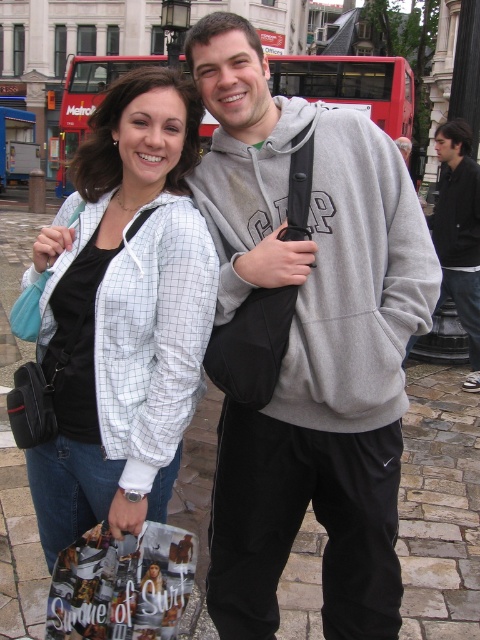
Which is in front, point (331, 307) or point (386, 128)?

Point (331, 307) is in front.

Is point (396, 516) less distant than point (312, 92)?

That is True.

You are a GUI agent. You are given a task and a screenshot of the screen. Output one action in this format:
    pyautogui.click(x=<x>, y=<y>)
    Task: Click on the gray cotton hoodie at center
    Image resolution: width=480 pixels, height=640 pixels.
    Given the screenshot: What is the action you would take?
    pyautogui.click(x=309, y=342)

The image size is (480, 640). I want to click on white checkered jacket at upper left, so click(x=123, y=316).

Who is positioned more to the right, white checkered jacket at upper left or red double-decker bus at upper center?

From the viewer's perspective, red double-decker bus at upper center appears more on the right side.

You are a GUI agent. You are given a task and a screenshot of the screen. Output one action in this format:
    pyautogui.click(x=<x>, y=<y>)
    Task: Click on the white checkered jacket at upper left
    
    Given the screenshot: What is the action you would take?
    pyautogui.click(x=123, y=316)

Does gray cotton hoodie at center appear over white checkered jacket at upper left?

No.

This screenshot has width=480, height=640. What do you see at coordinates (309, 342) in the screenshot?
I see `gray cotton hoodie at center` at bounding box center [309, 342].

At what (x,y) coordinates should I click in order to perform the action: click on gray cotton hoodie at center. Please return your answer as a coordinate pair (x, y). Image resolution: width=480 pixels, height=640 pixels. Looking at the image, I should click on (309, 342).